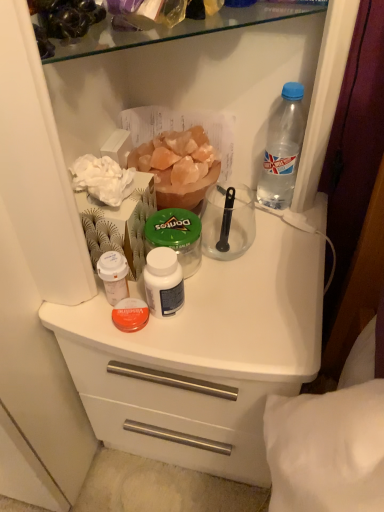
You are a GUI agent. You are given a task and a screenshot of the screen. Output one action in this format:
    pyautogui.click(x=<x>, y=<y>)
    Task: Click on the vacant space in front of green plastic jar at center
    Image resolution: width=384 pixels, height=512 pixels.
    Given the screenshot: What is the action you would take?
    pyautogui.click(x=203, y=333)